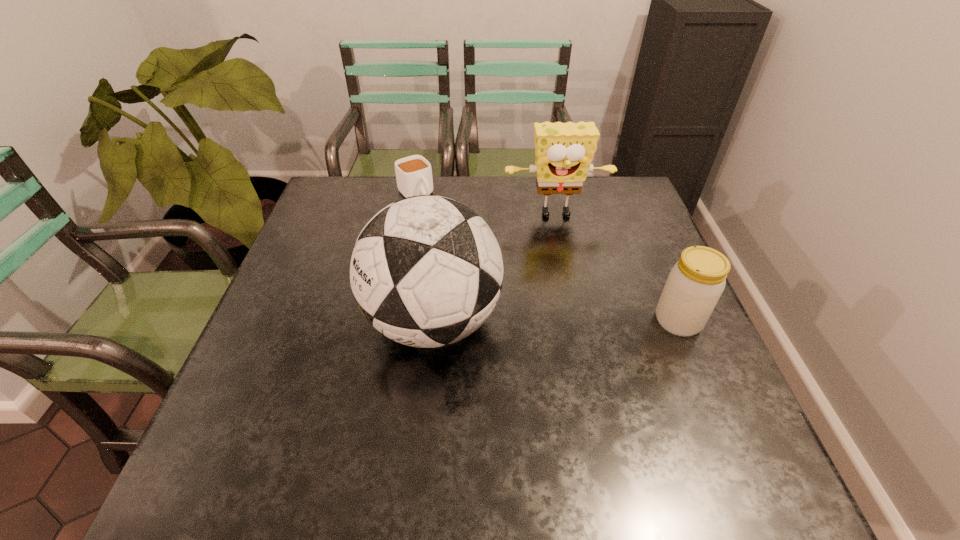
Where is `soccer ball`? The height and width of the screenshot is (540, 960). soccer ball is located at coordinates (426, 271).

This screenshot has width=960, height=540. Find the location of `the rightmost object`. the rightmost object is located at coordinates (695, 283).

Where is `jar`? The image size is (960, 540). jar is located at coordinates pos(695,283).

Identify the location of the second object from right to left. The height and width of the screenshot is (540, 960). (564, 151).

What are the coordinates of `sponge` in the screenshot? It's located at (564, 151).

Locate an element on the screen. Image resolution: width=960 pixels, height=540 pixels. the shortest object is located at coordinates (413, 174).

Locate an element on the screen. free space located 0.130m on the surface of the soccer ball where the brand logo is visible is located at coordinates (310, 321).

You are a GUI agent. You are given a task and a screenshot of the screen. Output one action in this format:
    pyautogui.click(x=<x>, y=<y>)
    Task: Click on the blank space located on the surface of the soccer ball where the brand logo is visible
    The height and width of the screenshot is (540, 960).
    Given the screenshot: What is the action you would take?
    pyautogui.click(x=275, y=321)

Find the location of a particular element. The height and width of the screenshot is (540, 960). free space located on the surface of the soccer ball where the brand logo is visible is located at coordinates (293, 321).

You are a GUI agent. You are given a task and a screenshot of the screen. Output one action in this format:
    pyautogui.click(x=<x>, y=<y>)
    Task: Click on the vacant space located 0.240m on the back of the rightmost object
    This screenshot has width=960, height=540.
    Given the screenshot: What is the action you would take?
    pyautogui.click(x=644, y=240)